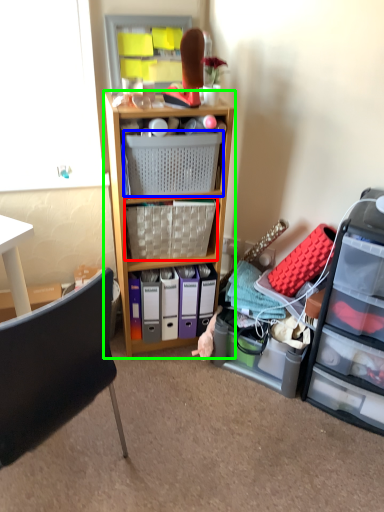
Question: Which is nearer to the picnic basket (highlighted by a red box)? picnic basket (highlighted by a blue box) or shelf (highlighted by a green box).

Choices:
 (A) picnic basket
 (B) shelf

Answer: (B)